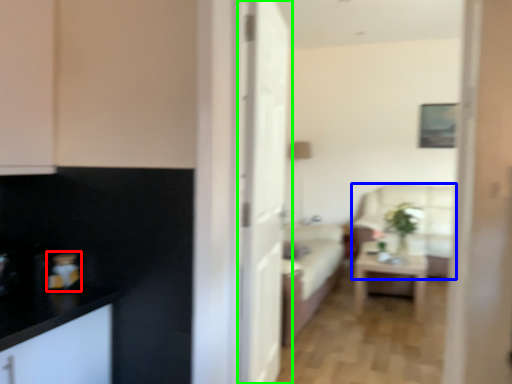
Question: Considering the real-world distances, which object is farthest from appliance (highlighted by a red box)? armchair (highlighted by a blue box) or door (highlighted by a green box)?

Choices:
 (A) armchair
 (B) door

Answer: (A)